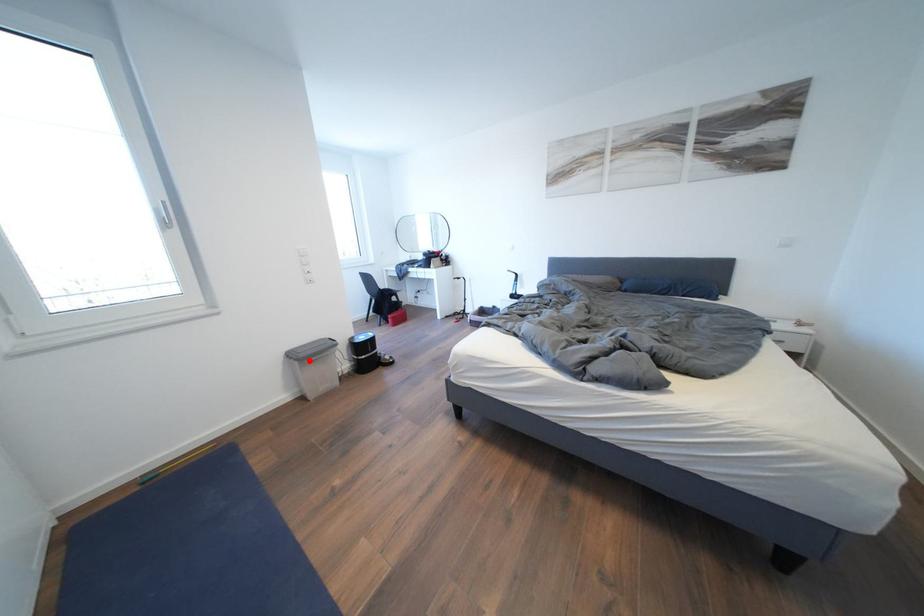
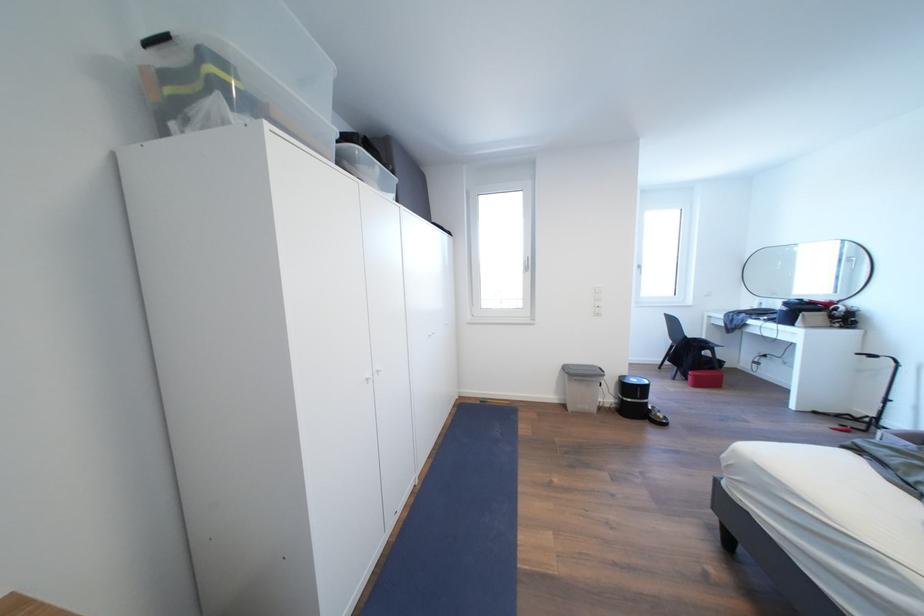
In the second image, find the point that corresponds to the highlighted location in the first image.

(579, 377)